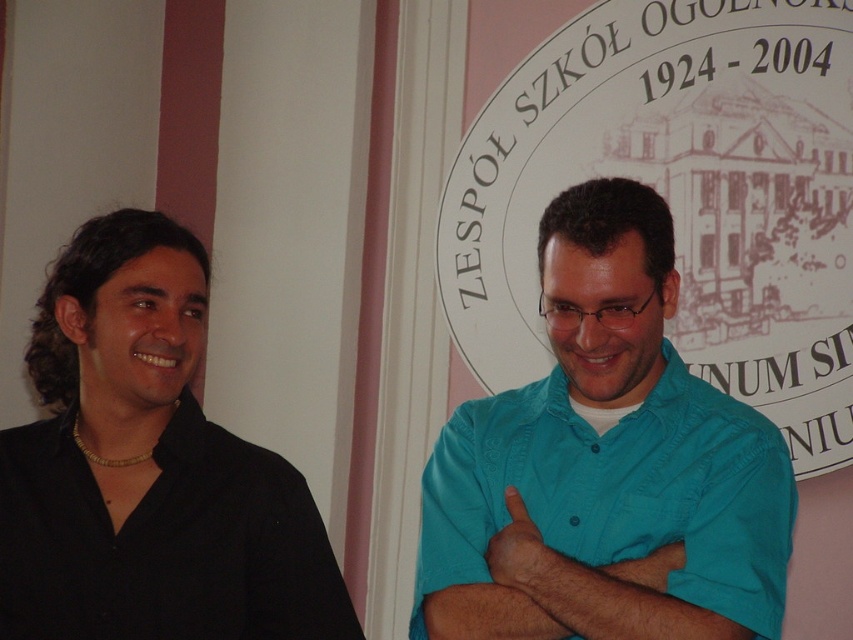
Who is taller, matte black shirt at left or teal cotton shirt at center?

teal cotton shirt at center

Is matte black shirt at left shorter than teal cotton shirt at center?

Yes.

You are a GUI agent. You are given a task and a screenshot of the screen. Output one action in this format:
    pyautogui.click(x=<x>, y=<y>)
    Task: Click on the matte black shirt at left
    
    Given the screenshot: What is the action you would take?
    pyautogui.click(x=613, y=465)

You are a GUI agent. You are given a task and a screenshot of the screen. Output one action in this format:
    pyautogui.click(x=<x>, y=<y>)
    Task: Click on the matte black shirt at left
    
    Given the screenshot: What is the action you would take?
    pyautogui.click(x=613, y=465)

Does matte black shirt at left have a greater width compared to black matte shirt at left?

Indeed, matte black shirt at left has a greater width compared to black matte shirt at left.

From the picture: Does matte black shirt at left appear over black matte shirt at left?

Yes.

Does point (579, 458) come farther from viewer compared to point (152, 394)?

Yes, point (579, 458) is behind point (152, 394).

The width and height of the screenshot is (853, 640). Find the location of `matte black shirt at left`. matte black shirt at left is located at coordinates (613, 465).

Is point (434, 472) positioned after point (71, 476)?

That is True.

Who is taller, teal cotton shirt at center or black matte shirt at left?

teal cotton shirt at center is taller.

Is point (531, 531) positioned before point (39, 452)?

Yes, it is in front of point (39, 452).

This screenshot has height=640, width=853. Identify the location of teal cotton shirt at center. (604, 464).